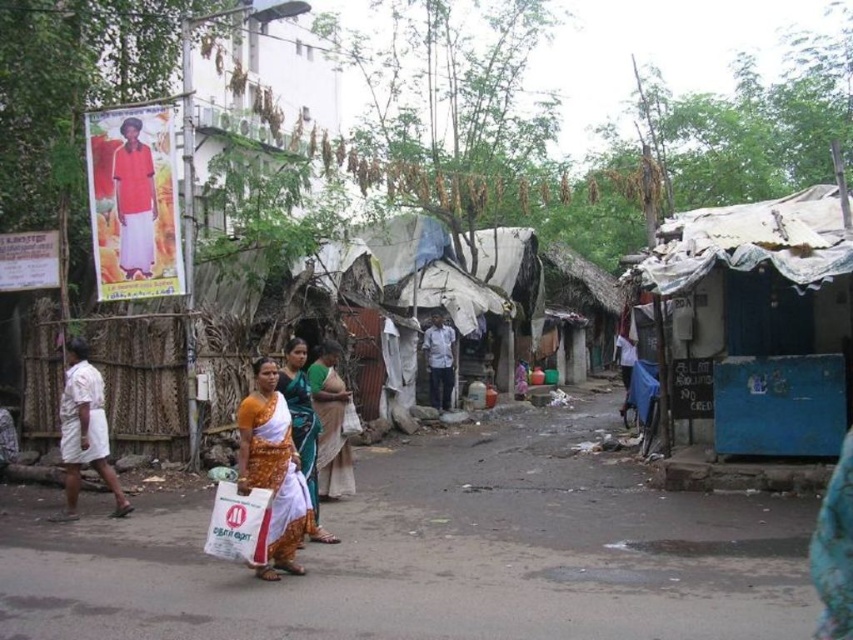
Does matte fabric alley at center come in front of blue tarpaulin hut at right?

Yes, matte fabric alley at center is closer to the viewer.

Image resolution: width=853 pixels, height=640 pixels. What do you see at coordinates (437, 554) in the screenshot?
I see `matte fabric alley at center` at bounding box center [437, 554].

I want to click on matte fabric alley at center, so click(x=437, y=554).

Does matte fabric alley at center have a lesser width compared to white cotton shirt at left?

In fact, matte fabric alley at center might be wider than white cotton shirt at left.

Between matte fabric alley at center and white cotton shirt at left, which one is positioned lower?

Positioned lower is matte fabric alley at center.

What do you see at coordinates (437, 554) in the screenshot? This screenshot has height=640, width=853. I see `matte fabric alley at center` at bounding box center [437, 554].

I want to click on matte fabric alley at center, so click(437, 554).

Who is more distant from viewer, (782, 211) or (332, 497)?

The point (782, 211) is behind.

Can you confirm if blue tarpaulin hut at right is positioned above green silk saree at center?

Correct, blue tarpaulin hut at right is located above green silk saree at center.

Does point (828, 397) come in front of point (341, 435)?

No, it is not.

I want to click on blue tarpaulin hut at right, so click(761, 317).